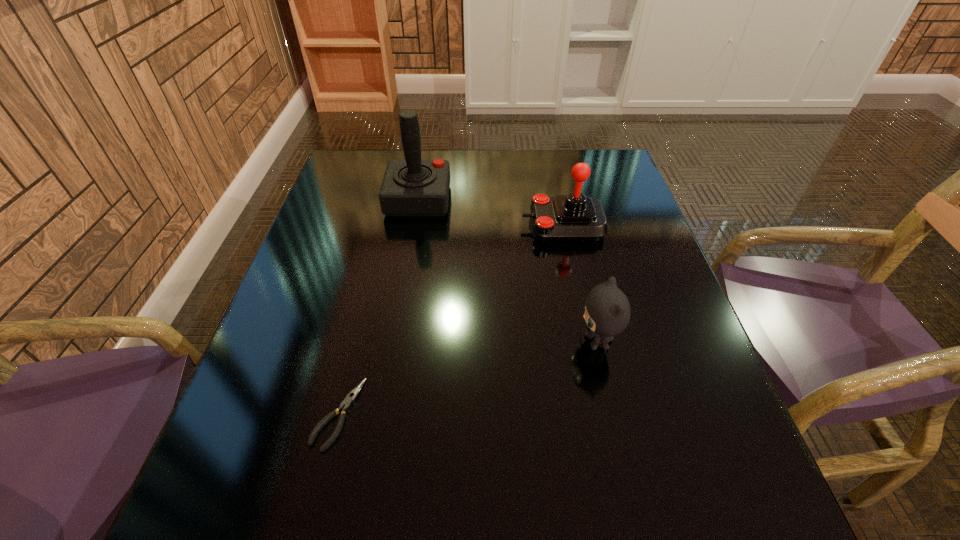
The height and width of the screenshot is (540, 960). I want to click on vacant region between the right joystick and the kitten, so click(x=580, y=284).

The height and width of the screenshot is (540, 960). I want to click on vacant region between the shortest object and the right joystick, so click(450, 320).

Find the location of a particular element. vacant area that lies between the shortest object and the right joystick is located at coordinates (450, 320).

The image size is (960, 540). In order to click on vacant area between the right joystick and the kitten in this screenshot , I will do 580,284.

I want to click on free space between the nearest object and the shorter joystick, so click(x=450, y=320).

Choose which object is the second nearest neighbor to the pliers. Please provide its 2D coordinates. Your answer should be formatted as a tuple, i.e. [(x, y)], where the tuple contains the x and y coordinates of a point satisfying the conditions above.

[(412, 187)]

This screenshot has width=960, height=540. I want to click on object that stands as the closest to the pliers, so click(607, 313).

Locate an element on the screen. The width and height of the screenshot is (960, 540). vacant position in the image that satisfies the following two spatial constraints: 1. on the base of the left joystick; 2. on the front side of the shortest object is located at coordinates (382, 414).

Where is `vacant space that satisfies the following two spatial constraints: 1. on the front-facing side of the second nearest object; 2. on the front side of the shortest object`? This screenshot has width=960, height=540. vacant space that satisfies the following two spatial constraints: 1. on the front-facing side of the second nearest object; 2. on the front side of the shortest object is located at coordinates (614, 414).